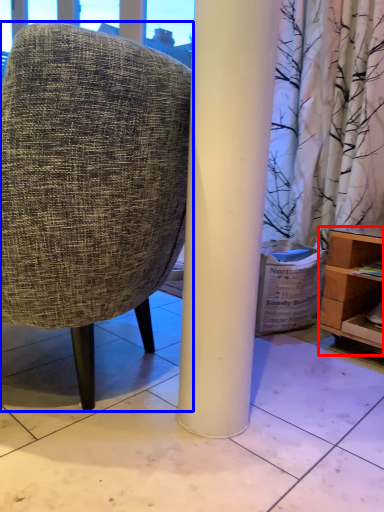
Question: Which object is further to the camera taking this photo, shelf (highlighted by a red box) or chair (highlighted by a blue box)?

Choices:
 (A) shelf
 (B) chair

Answer: (A)